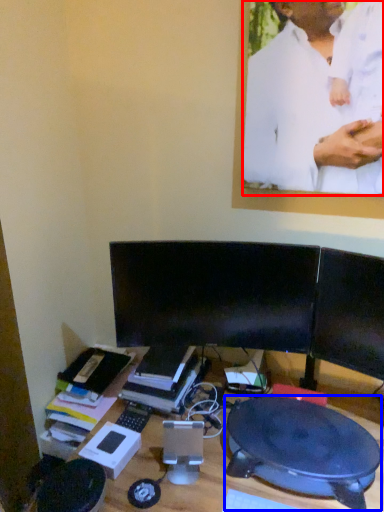
Question: Which object is further to the camera taking this photo, man (highlighted by a red box) or round table (highlighted by a blue box)?

Choices:
 (A) man
 (B) round table

Answer: (A)